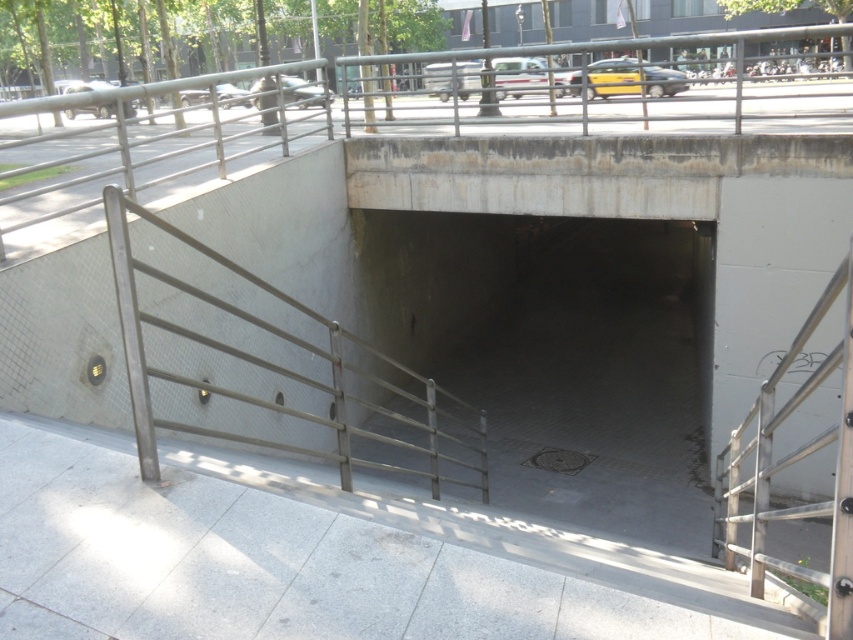
You are standing at the entrance of the underpass and see the point marked as point (318, 557). What is the surface material of the area where this point is located?

The point (318, 557) is on white tile pavement at lower center, so the surface material is white tile pavement.

You are a delivery person carrying a heavy box and need to walk through the underpass. You see the white tile pavement at lower center and the concrete tunnel at center. Which path should you take to reach the tunnel entrance quickly?

You should take the white tile pavement at lower center because it is closer to the viewer than the concrete tunnel at center, so it leads directly to the tunnel entrance.

You are a maintenance worker needing to inspect the concrete tunnel at center and the metallic silver railing at right. Which object should you check first if you are standing at the bottom of the stairs and want to ascend to higher ground?

You should check the concrete tunnel at center first because it is located above the metallic silver railing at right, so you can reach it by ascending from the bottom of the stairs.